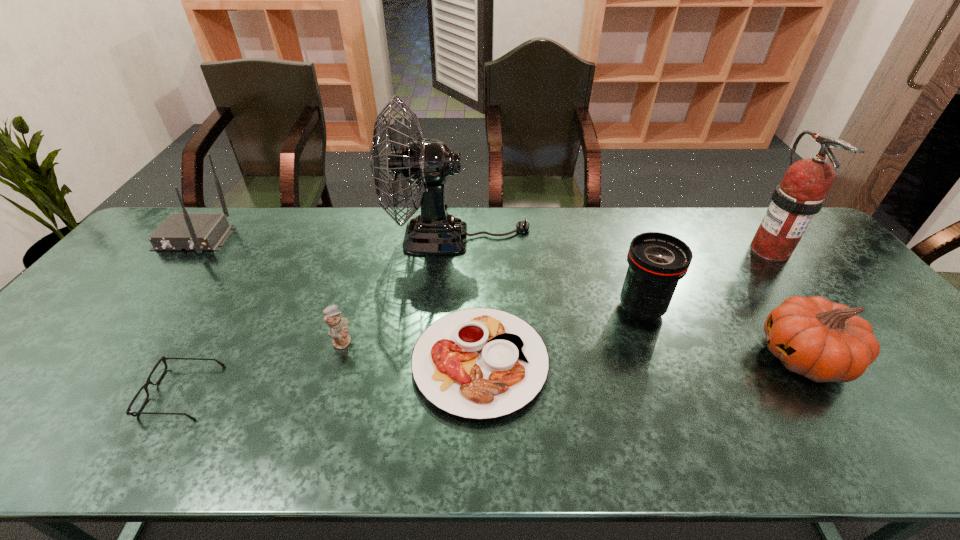
Locate an element on the screen. The height and width of the screenshot is (540, 960). blank space that satisfies the following two spatial constraints: 1. on the front-facing side of the spectacles; 2. on the left side of the platter is located at coordinates (199, 362).

Find the location of a particular element. free space that satisfies the following two spatial constraints: 1. at the nozzle of the fire extinguisher; 2. on the front-facing side of the teddy bear is located at coordinates (841, 341).